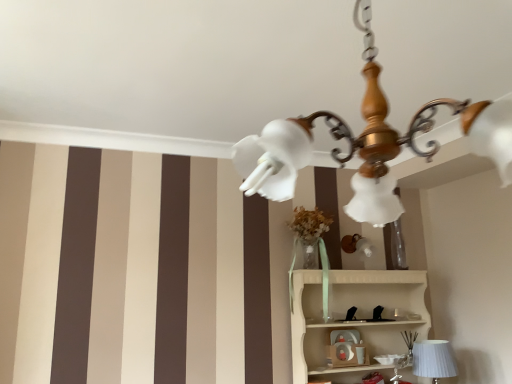
Question: Considering the relative sizes of matte plastic toy at center and wooden chandelier at upper center in the image provided, is matte plastic toy at center wider than wooden chandelier at upper center?

Choices:
 (A) yes
 (B) no

Answer: (B)

Question: Would you consider matte plastic toy at center to be distant from wooden chandelier at upper center?

Choices:
 (A) no
 (B) yes

Answer: (B)

Question: From the image's perspective, is matte plastic toy at center over wooden chandelier at upper center?

Choices:
 (A) yes
 (B) no

Answer: (B)

Question: Can you confirm if matte plastic toy at center is shorter than wooden chandelier at upper center?

Choices:
 (A) yes
 (B) no

Answer: (A)

Question: Does matte plastic toy at center contain wooden chandelier at upper center?

Choices:
 (A) yes
 (B) no

Answer: (B)

Question: From the image's perspective, relative to white ribbed fabric at lower right, is matte plastic toy at center above or below?

Choices:
 (A) below
 (B) above

Answer: (B)

Question: Considering the positions of matte plastic toy at center and white ribbed fabric at lower right in the image, is matte plastic toy at center wider or thinner than white ribbed fabric at lower right?

Choices:
 (A) wide
 (B) thin

Answer: (B)

Question: Based on their positions, is matte plastic toy at center located to the left or right of white ribbed fabric at lower right?

Choices:
 (A) left
 (B) right

Answer: (A)

Question: Relative to white ribbed fabric at lower right, is matte plastic toy at center in front or behind?

Choices:
 (A) behind
 (B) front

Answer: (A)

Question: From the image's perspective, is matte plastic toy at center positioned above or below white wood shelf at lower right?

Choices:
 (A) below
 (B) above

Answer: (A)

Question: From a real-world perspective, is matte plastic toy at center above or below white wood shelf at lower right?

Choices:
 (A) above
 (B) below

Answer: (B)

Question: Is matte plastic toy at center wider or thinner than white wood shelf at lower right?

Choices:
 (A) thin
 (B) wide

Answer: (A)

Question: Based on their positions, is matte plastic toy at center located to the left or right of white wood shelf at lower right?

Choices:
 (A) right
 (B) left

Answer: (B)

Question: From a real-world perspective, is wooden chandelier at upper center physically located above or below matte plastic toy at center?

Choices:
 (A) above
 (B) below

Answer: (A)

Question: From the image's perspective, is wooden chandelier at upper center located above or below matte plastic toy at center?

Choices:
 (A) above
 (B) below

Answer: (A)